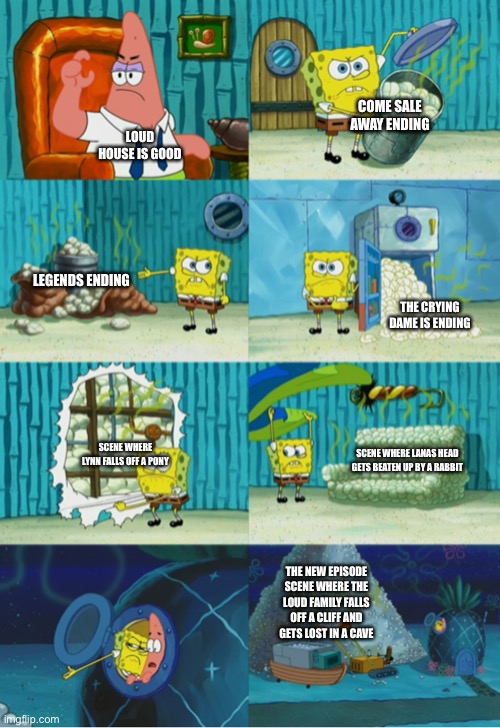
Identify the location of couch\. (387, 493).